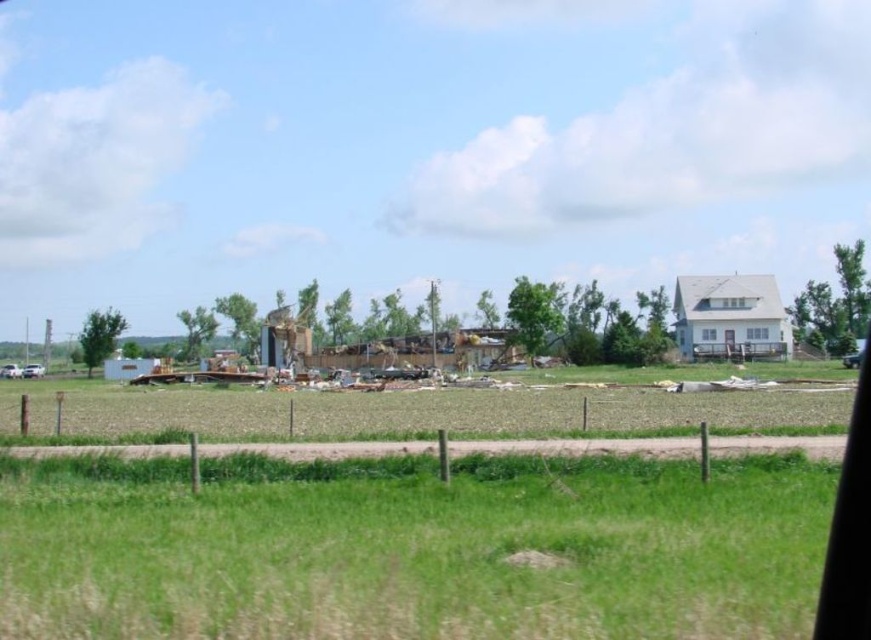
You are a gardener who wants to plant flowers in the green grass at lower center and the brown dirt field at center. Which area has more space available for planting?

The brown dirt field at center has more space available for planting since it is larger than the green grass at lower center.

You are standing at the edge of the field and want to walk towards the cluster of trees in the midground. Which direction should you go relative to the green grass at lower center and the brown dirt field at center?

You should head to the right of the brown dirt field at center because the green grass at lower center is to the left of it, so moving right would lead you towards the cluster of trees in the midground.